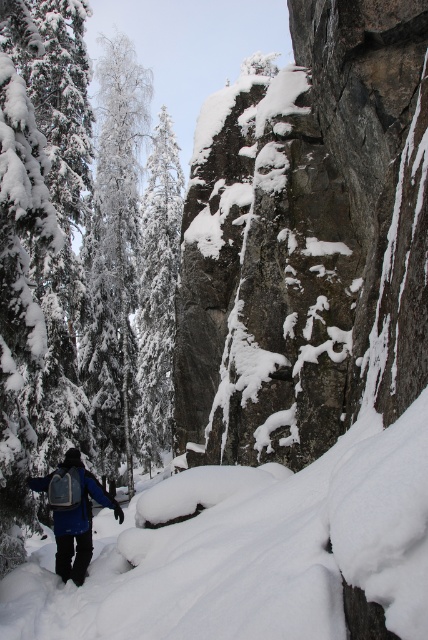
You are standing at the point closer to the camera in the image. Which point are you at, point (100,292) or point (77,573)?

You are at point (100,292) because it is further to the camera than point (77,573).

You are standing at the point marked by the coordinates point [113,259] in the winter forest scene. What is the nearest object to you?

The nearest object to point [113,259] is the white snow covered tree at left, as the point is located on it.